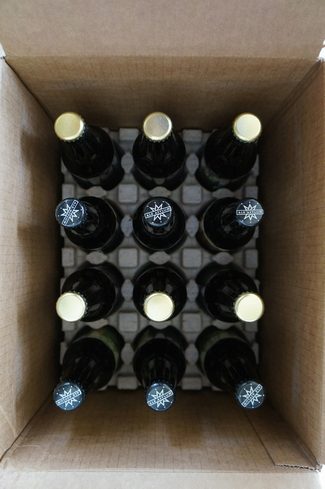
Locate an element on the screen. The height and width of the screenshot is (489, 325). box corners is located at coordinates (311, 461), (16, 440), (29, 91), (294, 96).